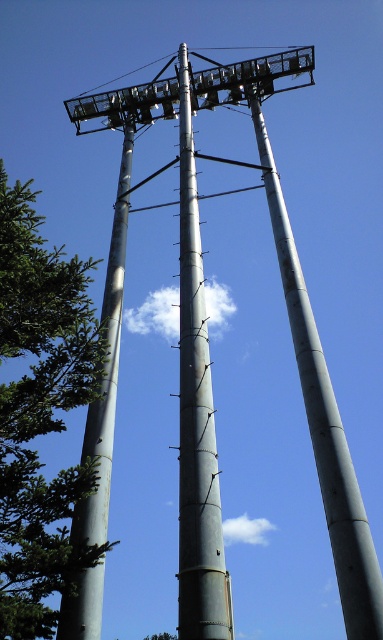
You are standing in front of the industrial structure and notice the green matte tree at left and the metallic gray pole at center. Which object is closer to you?

The green matte tree at left is closer to you because it is in front of the metallic gray pole at center.

You are standing at the base of the industrial structure and want to take a photo of the point labeled as point (x=36, y=273). The camera you are using has a maximum focus range of 50 feet. Will the camera be able to focus on that point?

The distance between point (x=36, y=273) and the camera is 55.85 feet, which exceeds the camera maximum focus range of 50 feet. Therefore, the camera will not be able to focus on that point.

You are standing at the base of the industrial structure and want to take a photo of the green matte tree at left. In which direction should you point your camera relative to the structure?

The green matte tree at left is located at point (40, 413), so you should point your camera to the left side of the industrial structure to capture the green matte tree at left.